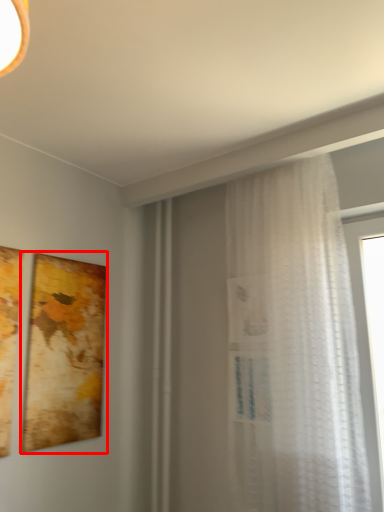
Question: Considering the relative positions of picture frame (annotated by the red box) and curtain in the image provided, where is picture frame (annotated by the red box) located with respect to the staircase?

Choices:
 (A) right
 (B) left

Answer: (B)